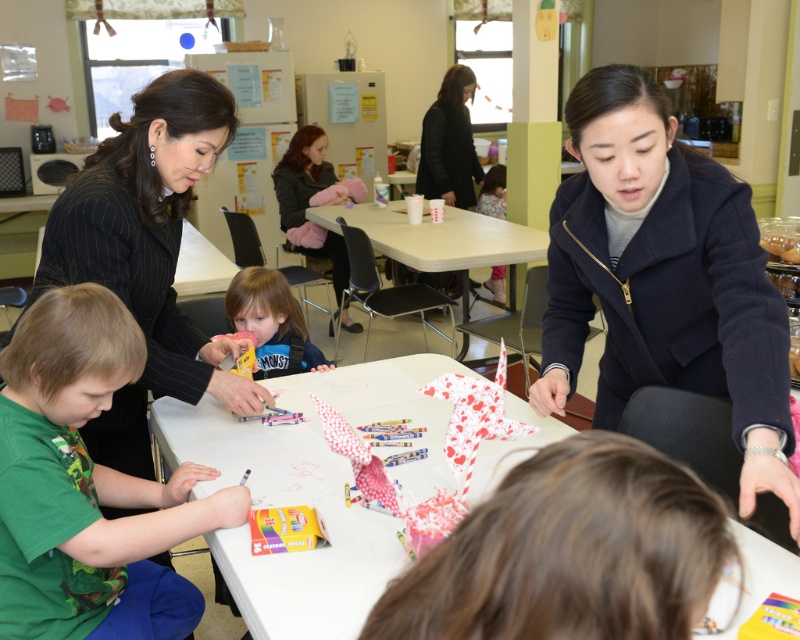
Question: Does matte yellow crayon at center appear on the left side of black fabric woman at upper center?

Choices:
 (A) no
 (B) yes

Answer: (B)

Question: Which object is positioned farthest from the smooth plastic table at center?

Choices:
 (A) black pinstripe suit at upper left
 (B) matte yellow crayon at center
 (C) white paper origami at center

Answer: (A)

Question: Can you confirm if white paper table at center is wider than white paper origami at center?

Choices:
 (A) yes
 (B) no

Answer: (A)

Question: Based on their relative distances, which object is farther from the white paper origami at center?

Choices:
 (A) navy wool coat at center
 (B) black fabric woman at upper center

Answer: (A)

Question: Which object is the closest to the matte yellow crayon at center?

Choices:
 (A) black fabric woman at upper center
 (B) navy wool coat at center

Answer: (B)

Question: Does white paper table at center have a larger size compared to black fabric woman at upper center?

Choices:
 (A) yes
 (B) no

Answer: (A)